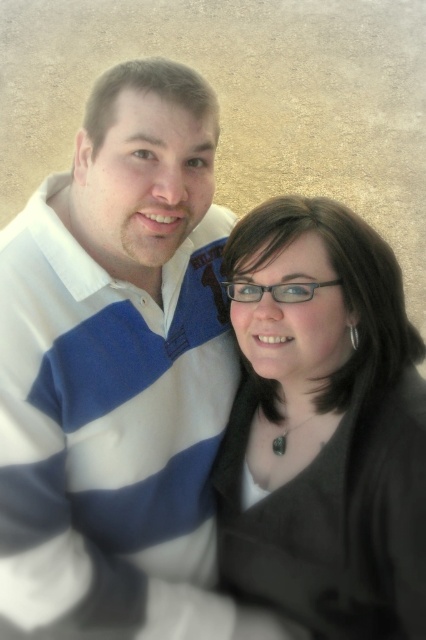
Question: Which point is farther from the camera taking this photo?

Choices:
 (A) (20, 451)
 (B) (253, 596)

Answer: (B)

Question: Is white striped sweater at left above black matte glasses at center?

Choices:
 (A) yes
 (B) no

Answer: (A)

Question: Is white striped sweater at left to the left of black matte glasses at center from the viewer's perspective?

Choices:
 (A) no
 (B) yes

Answer: (B)

Question: Can you confirm if white striped sweater at left is wider than black matte glasses at center?

Choices:
 (A) no
 (B) yes

Answer: (B)

Question: Which object is farther from the camera taking this photo?

Choices:
 (A) white striped sweater at left
 (B) black matte glasses at center

Answer: (B)

Question: Which point is closer to the camera?

Choices:
 (A) black matte glasses at center
 (B) white striped sweater at left

Answer: (B)